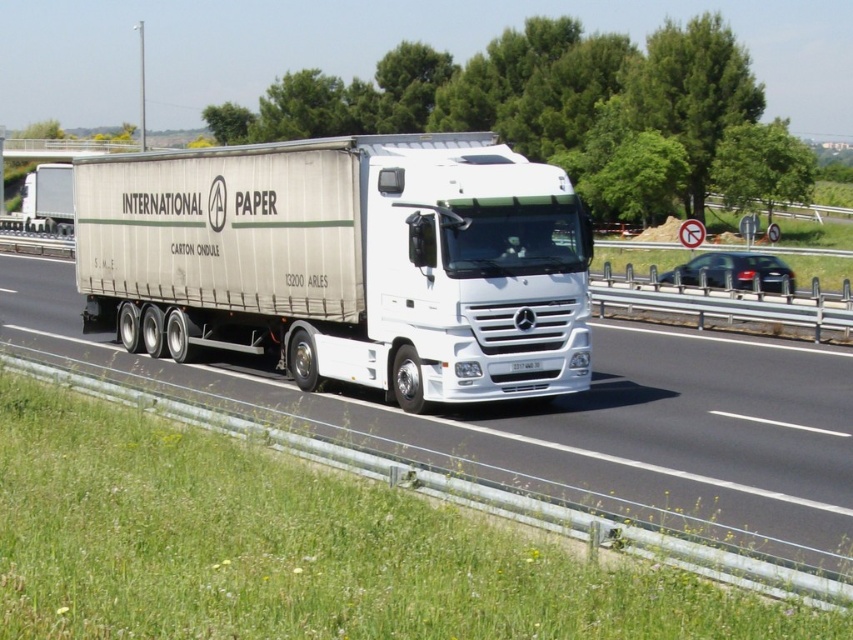
Question: Can you confirm if white matte trailer truck at center is positioned to the right of white glossy truck at center?

Choices:
 (A) yes
 (B) no

Answer: (B)

Question: Which point appears closest to the camera in this image?

Choices:
 (A) (296, 148)
 (B) (662, 497)

Answer: (B)

Question: Does white matte trailer truck at center lie in front of white glossy truck at center?

Choices:
 (A) yes
 (B) no

Answer: (B)

Question: Among these points, which one is farthest from the camera?

Choices:
 (A) (732, 480)
 (B) (550, 250)

Answer: (B)

Question: Is white matte trailer truck at center to the left of white glossy truck at center from the viewer's perspective?

Choices:
 (A) yes
 (B) no

Answer: (A)